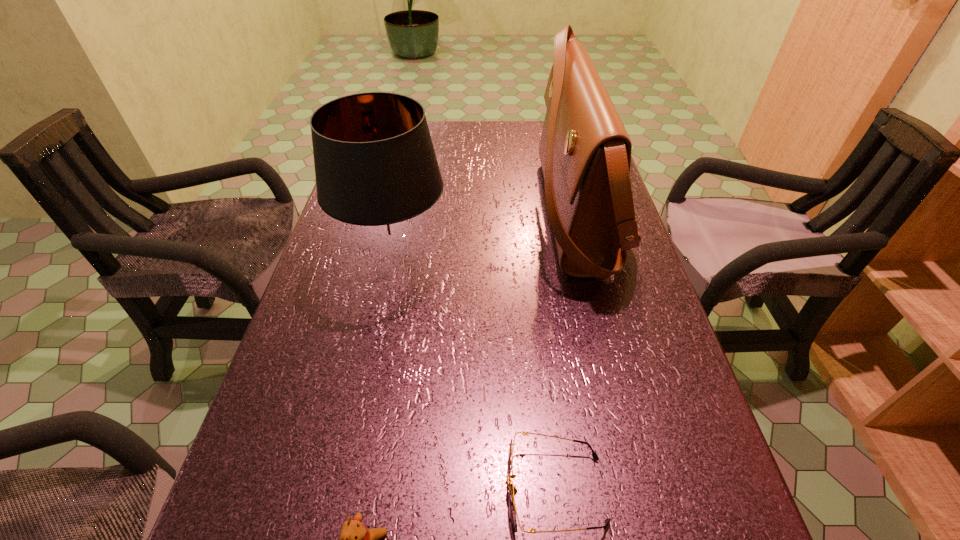
Locate an element on the screen. satchel is located at coordinates (585, 152).

Find the location of a particular element. Image resolution: width=960 pixels, height=540 pixels. lampshade is located at coordinates (377, 174).

Where is `vacant space located 0.130m on the front flap of the satchel`? The width and height of the screenshot is (960, 540). vacant space located 0.130m on the front flap of the satchel is located at coordinates (483, 214).

Identify the location of free spot located on the front flap of the satchel. (427, 214).

This screenshot has height=540, width=960. Find the location of `free region located on the front flap of the satchel`. free region located on the front flap of the satchel is located at coordinates (405, 214).

You are a GUI agent. You are given a task and a screenshot of the screen. Output one action in this format:
    pyautogui.click(x=<x>, y=<y>)
    Task: Click on the free location located 0.380m on the back of the lampshade
    
    Given the screenshot: What is the action you would take?
    pyautogui.click(x=417, y=157)

You are a GUI agent. You are given a task and a screenshot of the screen. Output one action in this format:
    pyautogui.click(x=<x>, y=<y>)
    Task: Click on the object that is at the left edge
    The image size is (960, 540).
    Given the screenshot: What is the action you would take?
    pyautogui.click(x=377, y=174)

Locate an element on the screen. object that is at the right edge is located at coordinates (585, 152).

In the image, there is a desktop. Where is `vacant space at the far edge`? The height and width of the screenshot is (540, 960). vacant space at the far edge is located at coordinates (456, 133).

I want to click on vacant region at the left edge of the desktop, so click(x=316, y=310).